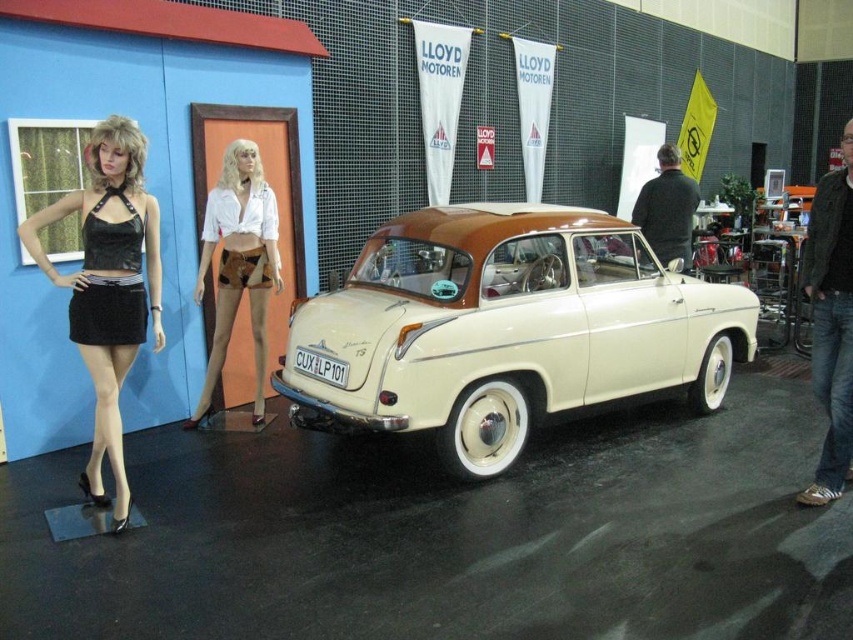
Question: Does brown suede shorts at center come in front of white metallic license plate at center?

Choices:
 (A) yes
 (B) no

Answer: (B)

Question: Which object appears farthest from the camera in this image?

Choices:
 (A) black satin miniskirt at left
 (B) black velvet dress at left
 (C) beige glossy car at center

Answer: (C)

Question: Does black velvet dress at left lie behind white metallic license plate at center?

Choices:
 (A) no
 (B) yes

Answer: (A)

Question: Which of the following is the closest to the observer?

Choices:
 (A) black leather miniskirt at center
 (B) beige glossy car at center
 (C) black velvet dress at left

Answer: (C)

Question: Does black velvet dress at left appear over brown suede shorts at center?

Choices:
 (A) yes
 (B) no

Answer: (B)

Question: Among these points, which one is farthest from the camera?

Choices:
 (A) (225, 147)
 (B) (107, 387)

Answer: (A)